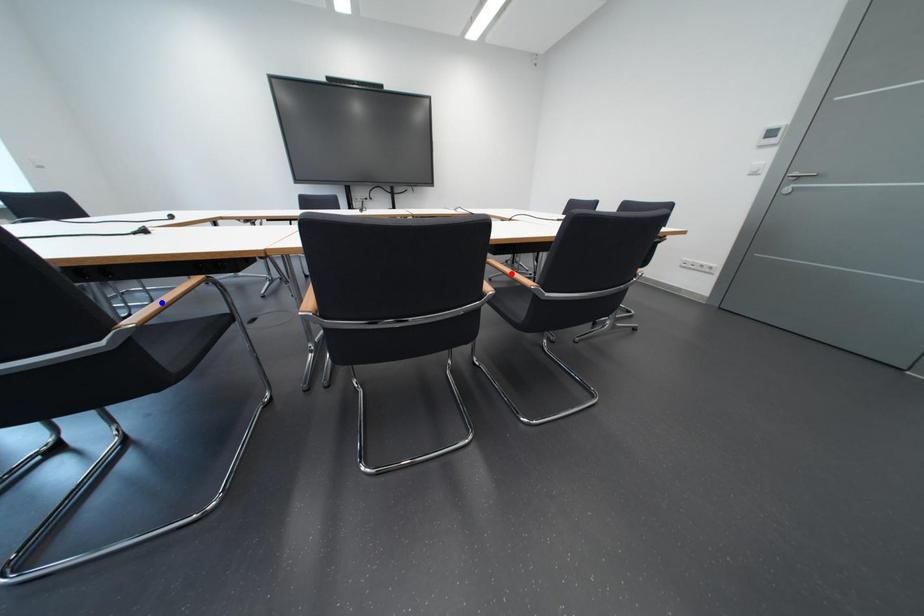
Question: In the image, two points are highlighted. Which point is nearer to the camera? Reply with the corresponding letter.

Choices:
 (A) blue point
 (B) red point

Answer: (A)